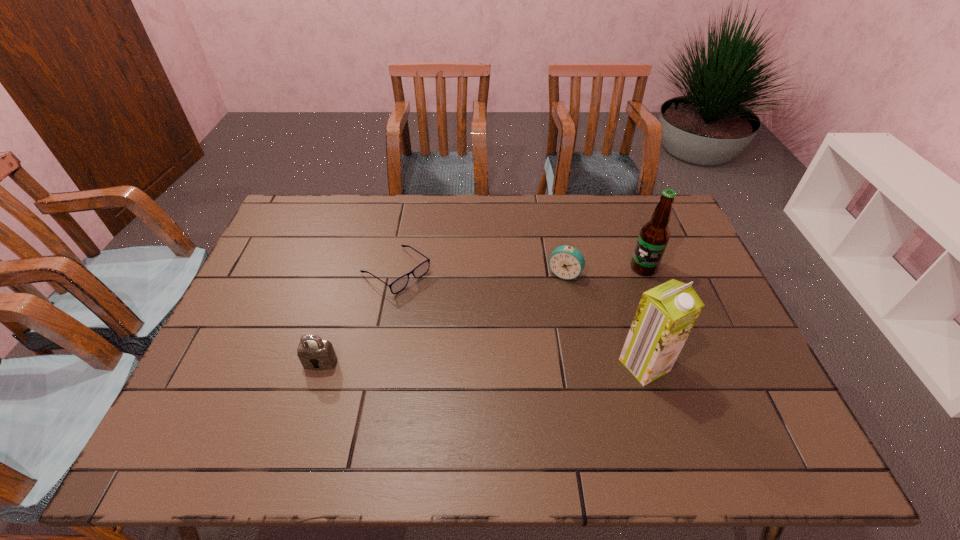
Find the location of `free space at the left edge`. free space at the left edge is located at coordinates (270, 360).

You are a GUI agent. You are given a task and a screenshot of the screen. Output one action in this format:
    pyautogui.click(x=<x>, y=<y>)
    Task: Click on the free space at the right edge of the desktop
    The width and height of the screenshot is (960, 540).
    Given the screenshot: What is the action you would take?
    pyautogui.click(x=710, y=351)

You are a GUI agent. You are given a task and a screenshot of the screen. Output one action in this format:
    pyautogui.click(x=<x>, y=<y>)
    Task: Click on the free space at the far left corner of the desktop
    
    Given the screenshot: What is the action you would take?
    pyautogui.click(x=323, y=230)

Identify the location of vacant space at the far right corner of the desktop. This screenshot has width=960, height=540. (650, 213).

Locate an element on the screen. vacant space at the near right corner of the desktop is located at coordinates (758, 392).

The height and width of the screenshot is (540, 960). I want to click on free point between the alarm clock and the beer bottle, so click(604, 271).

Locate an element on the screen. This screenshot has width=960, height=540. empty location between the third object from left to right and the shortest object is located at coordinates (480, 273).

The width and height of the screenshot is (960, 540). I want to click on empty space that is in between the padlock and the third object from right to left, so click(443, 319).

I want to click on vacant space in between the shortest object and the third object from left to right, so click(480, 273).

Where is `free point between the third object from left to right and the shortest object`? free point between the third object from left to right and the shortest object is located at coordinates (480, 273).